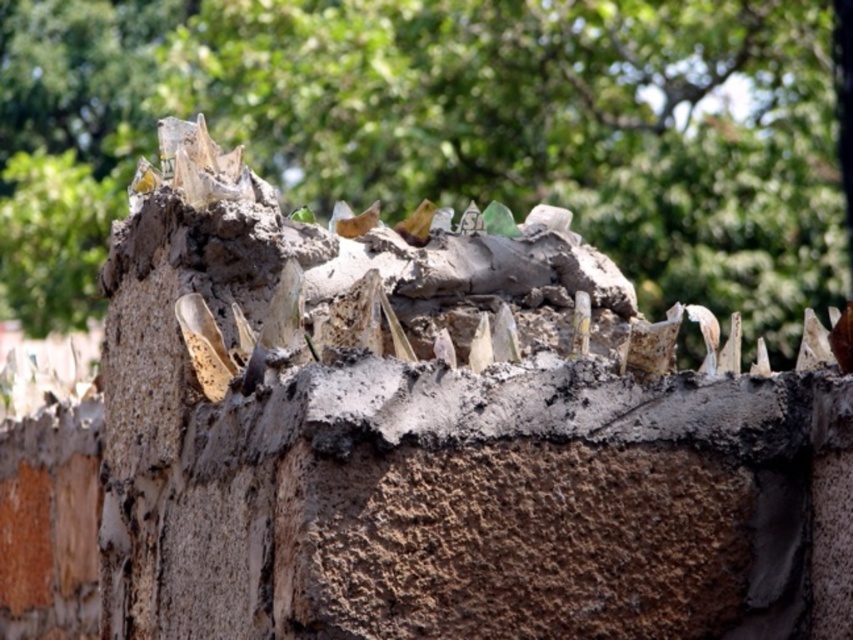
Question: Which point is farther from the camera taking this photo?

Choices:
 (A) (668, 264)
 (B) (523, 632)

Answer: (A)

Question: Can you confirm if brown rough stone at upper center is positioned to the right of green leafy tree at upper center?

Choices:
 (A) no
 (B) yes

Answer: (B)

Question: Does brown rough stone at upper center appear over green leafy tree at upper center?

Choices:
 (A) yes
 (B) no

Answer: (B)

Question: Which point is closer to the camera taking this photo?

Choices:
 (A) click(801, 26)
 (B) click(627, 449)

Answer: (B)

Question: Does brown rough stone at upper center have a smaller size compared to green leafy tree at upper center?

Choices:
 (A) yes
 (B) no

Answer: (A)

Question: Which point is closer to the camera taking this photo?

Choices:
 (A) (171, 193)
 (B) (521, 49)

Answer: (A)